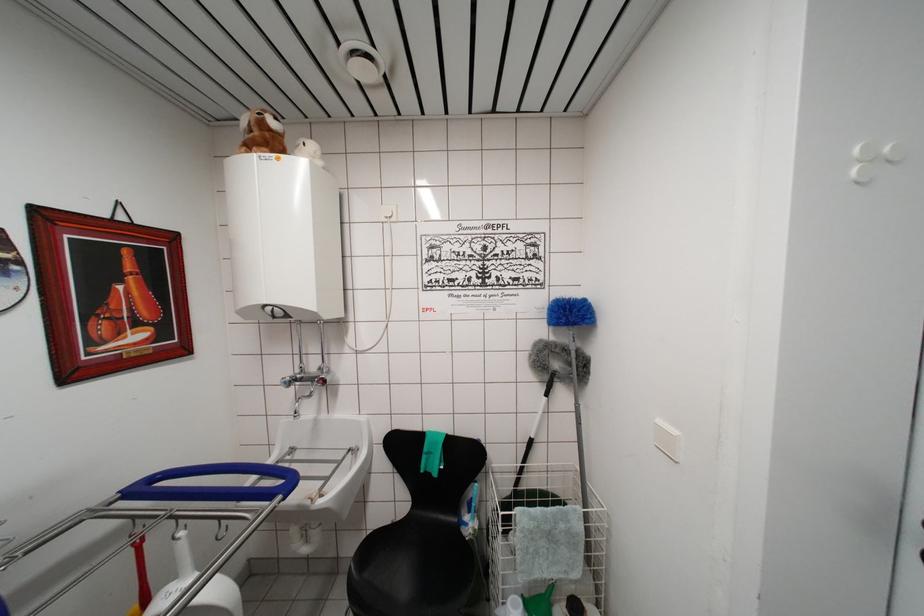
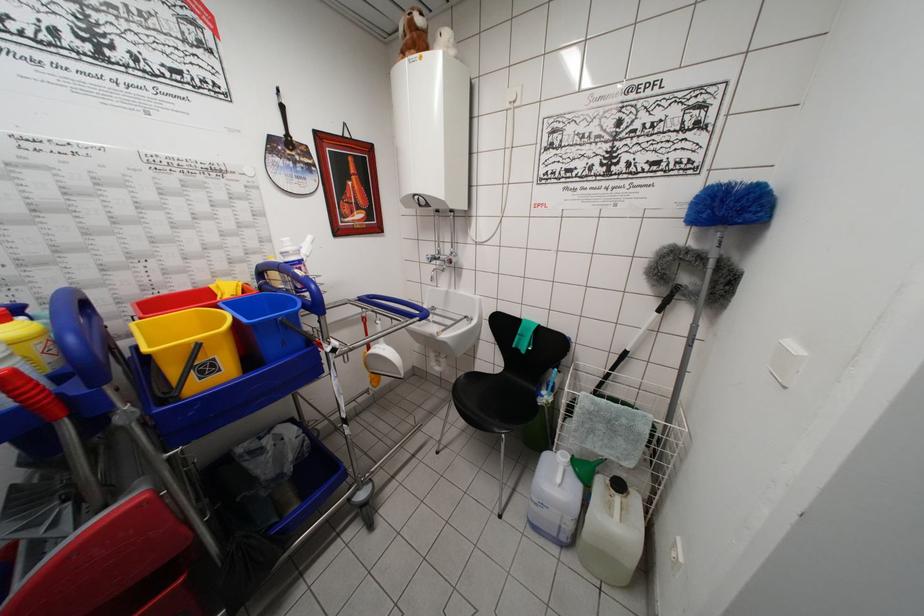
Where in the second image is the point corresponding to point (122, 496) from the first image?

(360, 302)